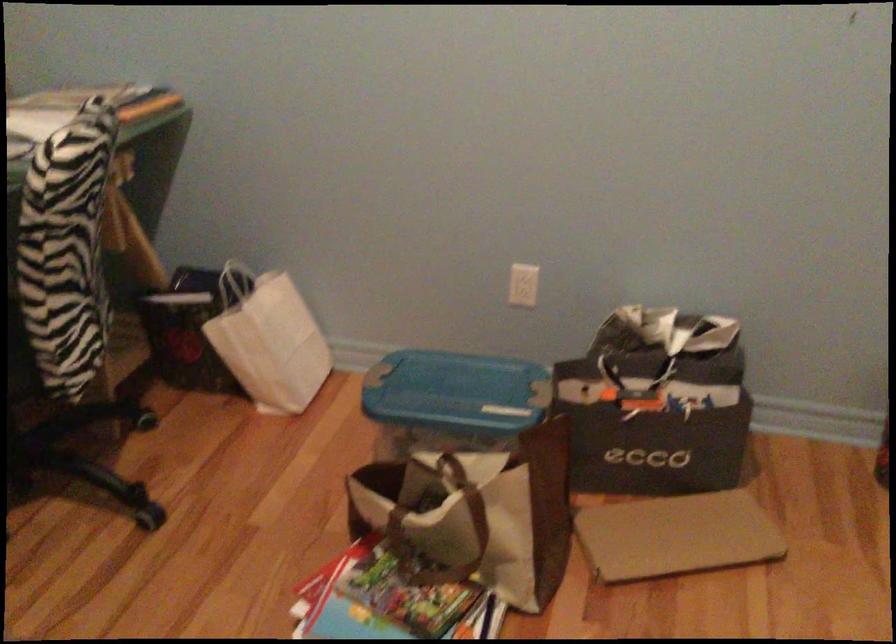
Find where to open the colorful book. Please return your answer as a coordinate pair (x, y).

(388, 601)